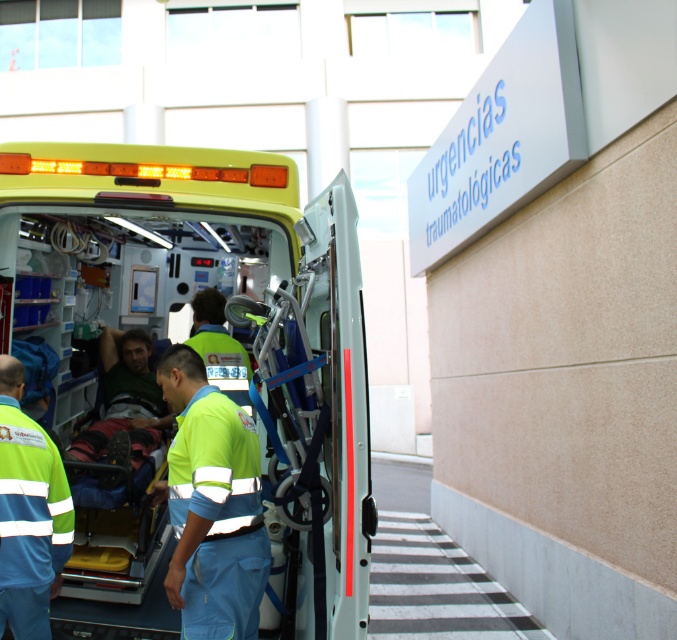
You are a paramedic standing at the entrance of the hospital. You need to quickly access the medical supplies inside the yellow matte ambulance at center. Considering your height is 1.75 meters, can you comfortably reach the supplies inside the ambulance without needing a ladder?

The yellow matte ambulance at center is 4.03 meters away from you. Since the distance is not related to the height required to reach the supplies, your height of 1.75 meters would determine if you can reach. However, the question does not provide information about the height of the ambulance doors or storage compartments. Therefore, it is impossible to determine if you can comfortably reach the supplies based on the given details.

You are a patient who just arrived at the hospital entrance and see two medical staff members in the foreground. One is wearing a green reflective uniform at center and the other has a green fabric shirt at center. Which staff member is wearing clothing with a narrower width?

The green reflective uniform at center has a lesser width compared to the green fabric shirt at center, so the staff member in the green reflective uniform at center is wearing clothing with a narrower width.